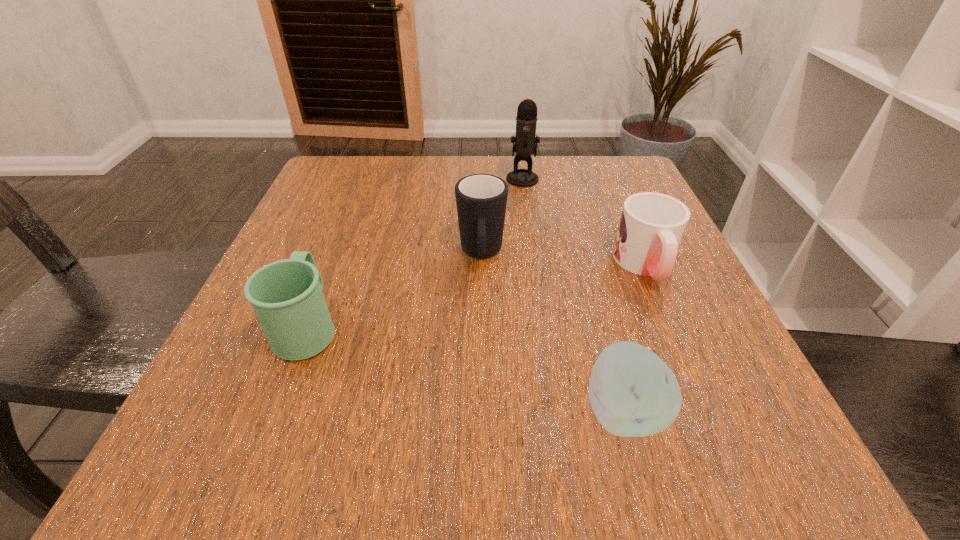
At what (x,y) coordinates should I click in order to perform the action: click on the tallest object. Please return your answer as a coordinate pair (x, y). The height and width of the screenshot is (540, 960). Looking at the image, I should click on (526, 140).

Locate an element on the screen. the farthest object is located at coordinates (526, 140).

Locate an element on the screen. The image size is (960, 540). the second object from left to right is located at coordinates (481, 199).

Locate an element on the screen. This screenshot has width=960, height=540. the leftmost object is located at coordinates (287, 297).

In order to click on the fourth farthest object in this screenshot , I will do `click(287, 297)`.

This screenshot has height=540, width=960. I want to click on apple, so click(x=633, y=393).

This screenshot has height=540, width=960. What are the coordinates of `the rightmost object` in the screenshot? It's located at (652, 225).

What are the coordinates of `free space located on the left of the tallest object` in the screenshot? It's located at (382, 179).

Identify the location of vacant space located on the side of the second mug from left to right with the handle. (482, 368).

In order to click on free space located on the side of the leftmost object with the handle in this screenshot , I will do `click(342, 241)`.